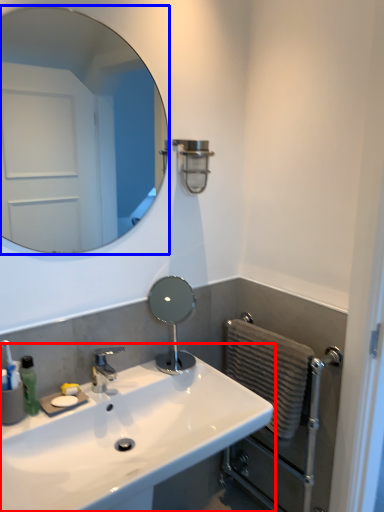
Question: Among these objects, which one is farthest to the camera, sink (highlighted by a red box) or mirror (highlighted by a blue box)?

Choices:
 (A) sink
 (B) mirror

Answer: (B)